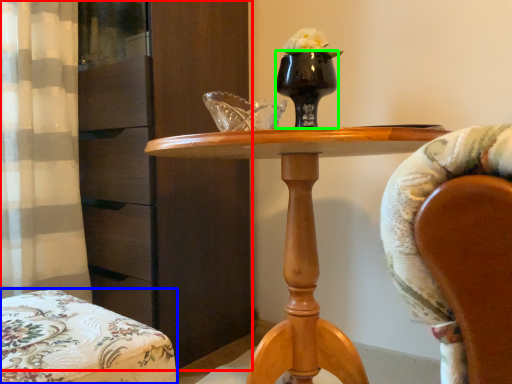
Question: Which is farther away from dresser (highlighted by a red box)? chair (highlighted by a blue box) or vase (highlighted by a green box)?

Choices:
 (A) chair
 (B) vase

Answer: (A)